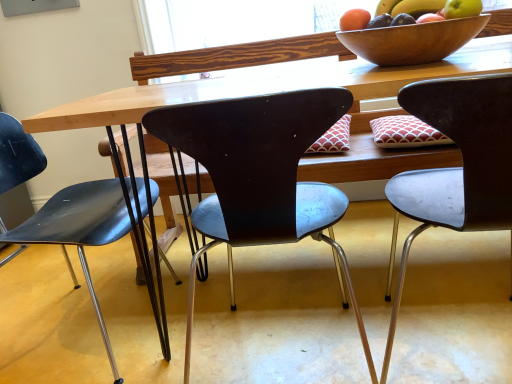
Question: Does point (367, 11) appear closer or farther from the camera than point (402, 279)?

Choices:
 (A) closer
 (B) farther

Answer: (A)

Question: Considering the positions of matte orange at upper right and metallic gray chair at right, which appears as the third chair when viewed from the left, in the image, is matte orange at upper right taller or shorter than metallic gray chair at right, which appears as the third chair when viewed from the left,?

Choices:
 (A) tall
 (B) short

Answer: (B)

Question: Which object is the farthest from the wooden bowl at upper right?

Choices:
 (A) matte orange at upper right
 (B) orange matte grapefruit at upper right
 (C) metallic gray chair at right, which is the 1th chair in right-to-left order
 (D) matte black chair at center, which is counted as the 3th chair, starting from the right
 (E) matte black chair at center, the second chair positioned from the right

Answer: (D)

Question: Which object is the closest to the orange matte grapefruit at upper right?

Choices:
 (A) matte black chair at center, which is the first chair from left to right
 (B) matte orange at upper right
 (C) wooden bowl at upper right
 (D) matte black chair at center, which is the second chair in left-to-right order
 (E) metallic gray chair at right, which appears as the third chair when viewed from the left

Answer: (C)